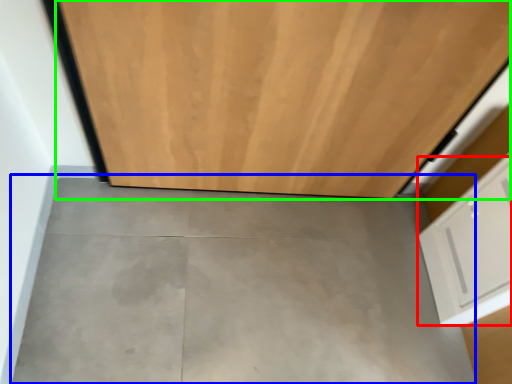
Question: Which is farther away from drawer (highlighted by a red box)? concrete (highlighted by a blue box) or door (highlighted by a green box)?

Choices:
 (A) concrete
 (B) door

Answer: (B)